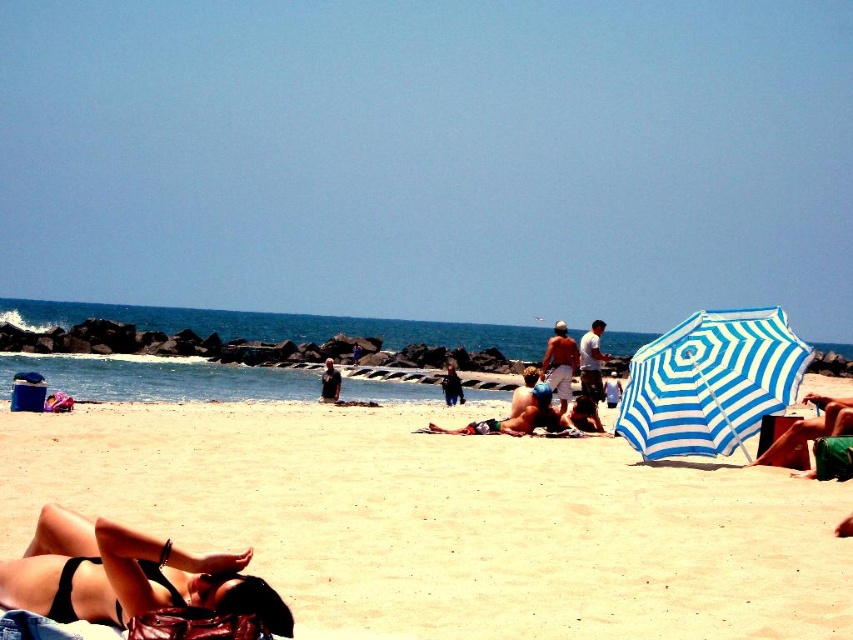
Can you confirm if black bikini at lower left is bigger than dark blue t-shirt at center?

Incorrect, black bikini at lower left is not larger than dark blue t-shirt at center.

Image resolution: width=853 pixels, height=640 pixels. What do you see at coordinates (132, 579) in the screenshot?
I see `black bikini at lower left` at bounding box center [132, 579].

Identify the location of black bikini at lower left. (132, 579).

Is black bikini at lower left positioned at the back of blue striped umbrella at right?

No.

Locate an element on the screen. The width and height of the screenshot is (853, 640). black bikini at lower left is located at coordinates (132, 579).

Does black bikini at lower left have a lesser height compared to green cotton shorts at lower right?

Yes, black bikini at lower left is shorter than green cotton shorts at lower right.

Between point (123, 620) and point (796, 428), which one is positioned behind?

Positioned behind is point (796, 428).

Identify the location of black bikini at lower left. (132, 579).